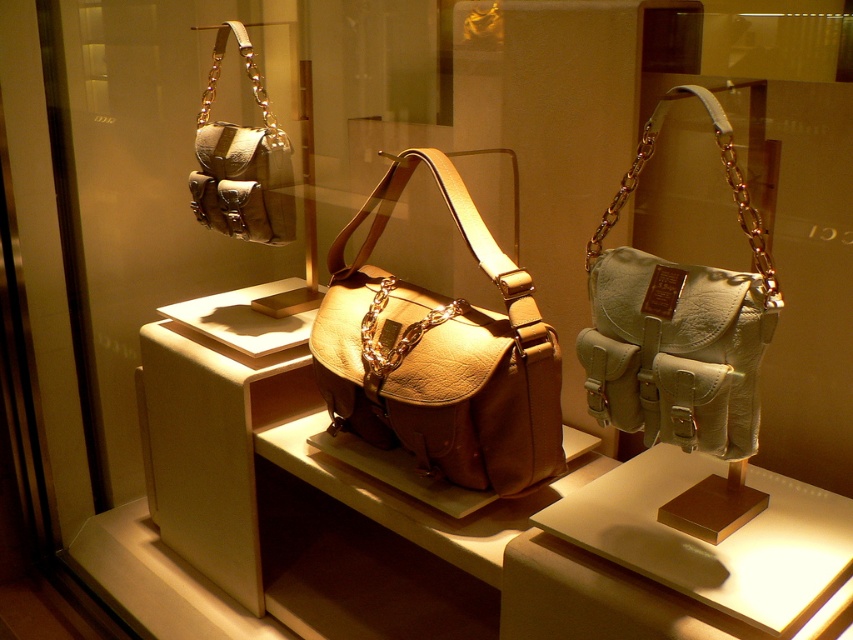
You are a customer in the store and want to pick up the leather bag at center and the light beige leather handbag at right. Which one is closer to your right hand?

The light beige leather handbag at right is closer to your right hand because it is positioned on the right side of the leather bag at center.

You are a customer standing in front of the store window. You see the leather bag at center and the matte brown leather handbag at upper left. Which bag is closer to you?

The leather bag at center is closer to you because it is in front of the matte brown leather handbag at upper left.